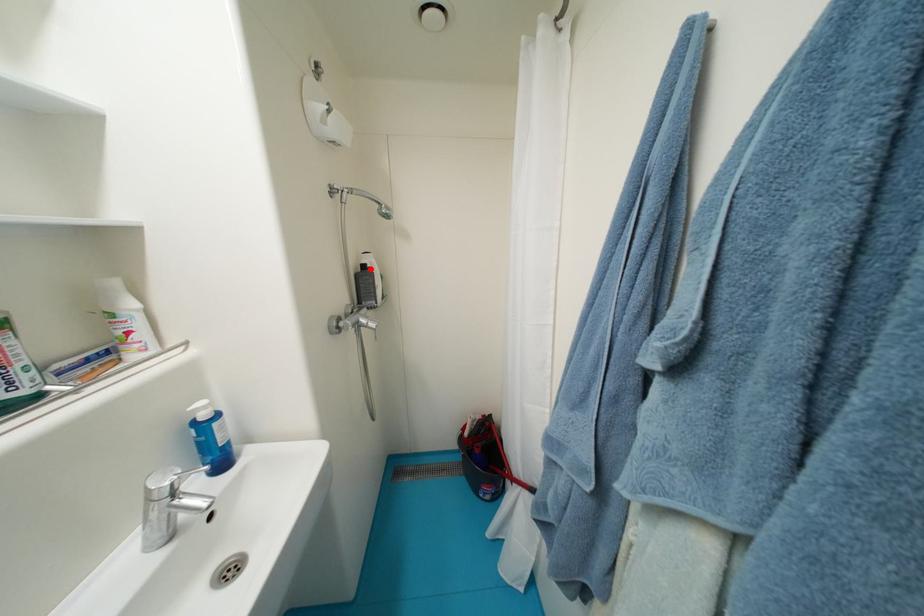
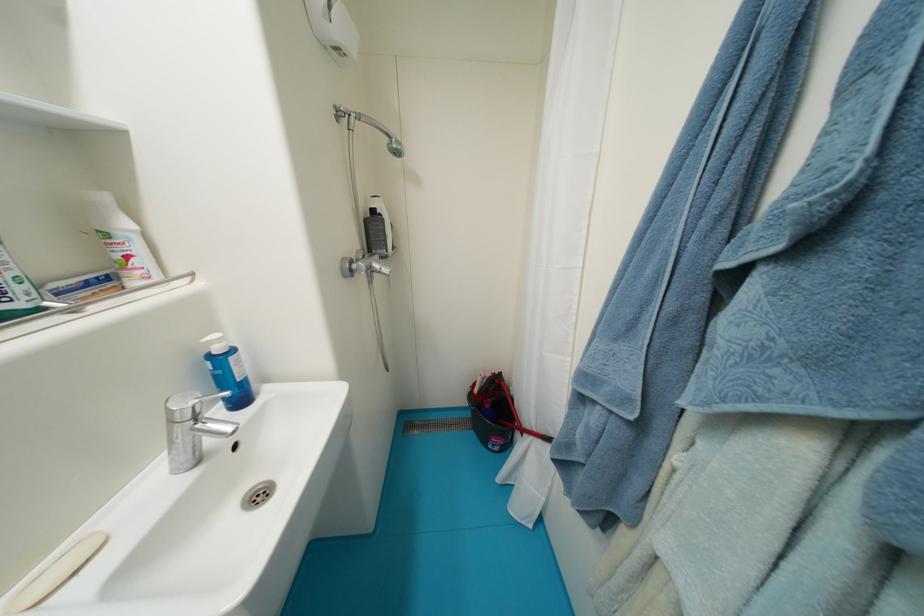
The point at the highlighted location is marked in the first image. Where is the corresponding point in the second image?

(380, 214)